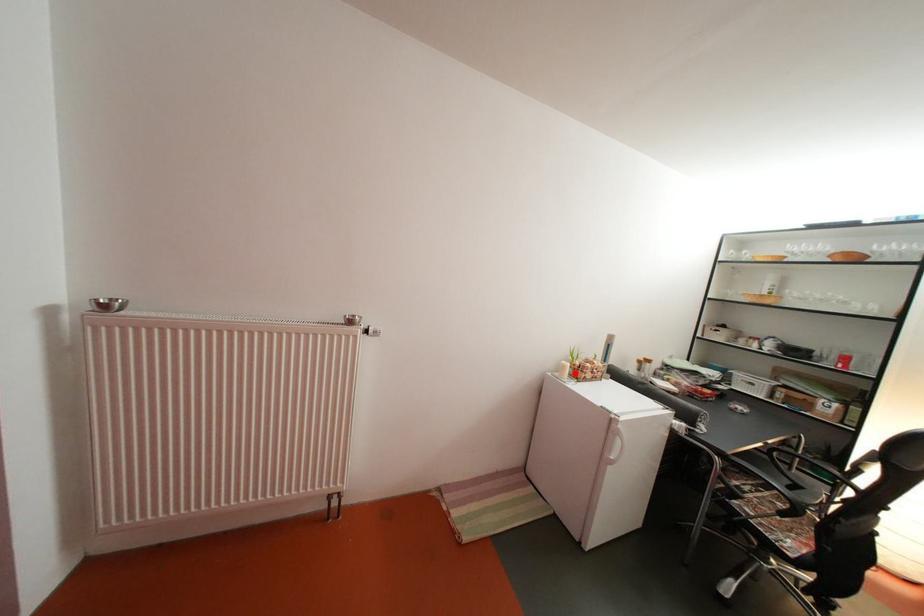
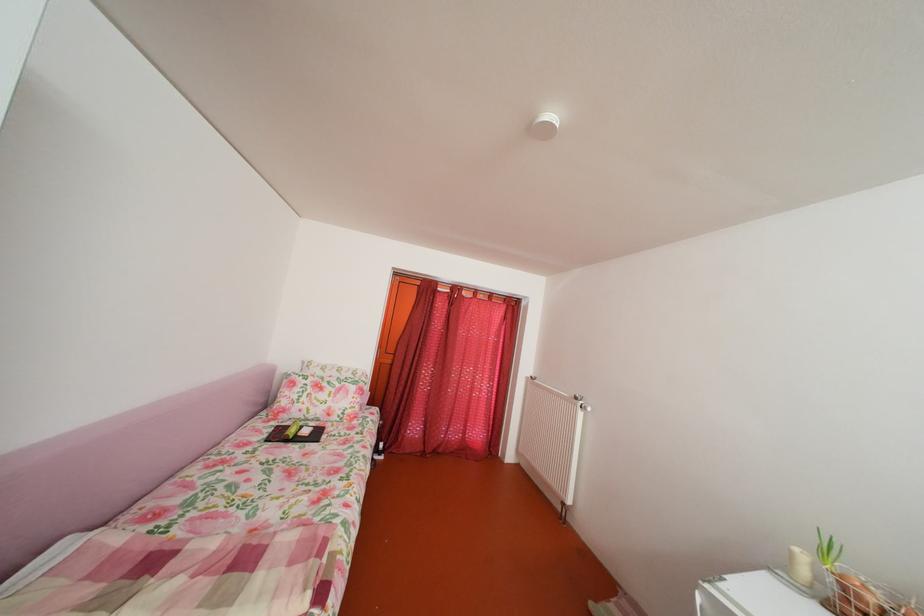
Find the pixel in the second image that matches the highlighted location in the first image.

(803, 561)